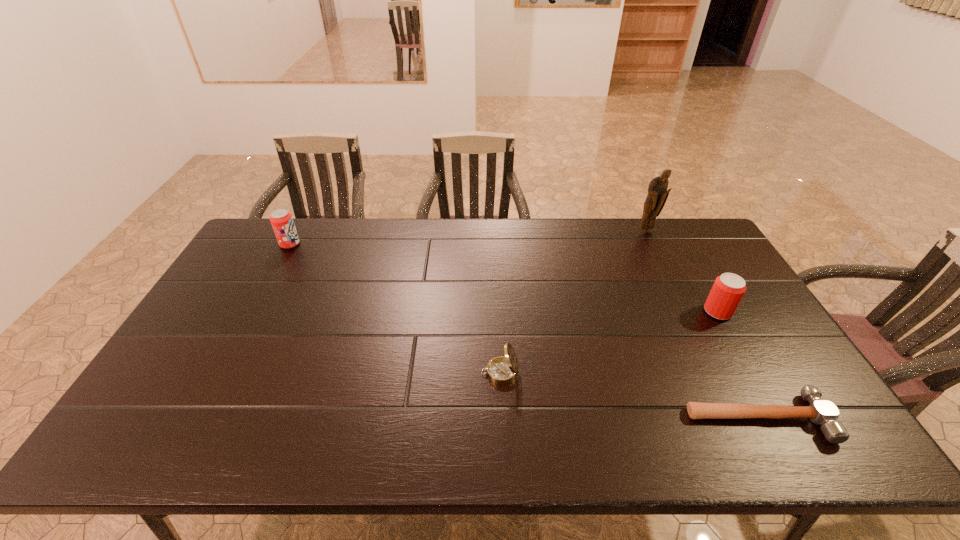
You are a GUI agent. You are given a task and a screenshot of the screen. Output one action in this format:
    pyautogui.click(x=<x>, y=<y>)
    Task: Click on the free space located on the surface of the leftmost object
    
    Given the screenshot: What is the action you would take?
    pyautogui.click(x=368, y=244)

What are the coordinates of `vacant region located on the back of the beer can` in the screenshot? It's located at (687, 257).

Where is `free space located 0.240m with the dial facing the compass`? Image resolution: width=960 pixels, height=540 pixels. free space located 0.240m with the dial facing the compass is located at coordinates (389, 373).

Find the location of a particular element. The height and width of the screenshot is (540, 960). vacant space situated with the dial facing the compass is located at coordinates (335, 373).

What are the coordinates of `vacant space located with the dial facing the compass` in the screenshot? It's located at (327, 373).

The width and height of the screenshot is (960, 540). Identify the location of vacant region located 0.080m on the left of the shortest object. (655, 417).

Locate an element on the screen. This screenshot has height=540, width=960. figurine positioned at the far edge is located at coordinates (657, 195).

This screenshot has height=540, width=960. I want to click on soda can situated at the far edge, so click(281, 220).

Find the location of `object located at the near edge`. object located at the near edge is located at coordinates (820, 412).

Find the location of a particular element. The width and height of the screenshot is (960, 540). object located in the left edge section of the desktop is located at coordinates (281, 220).